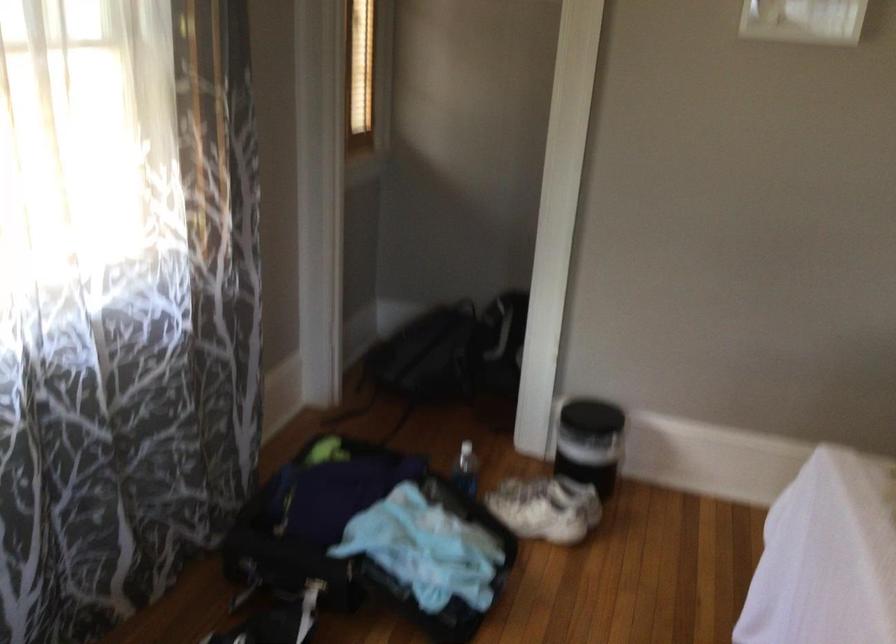
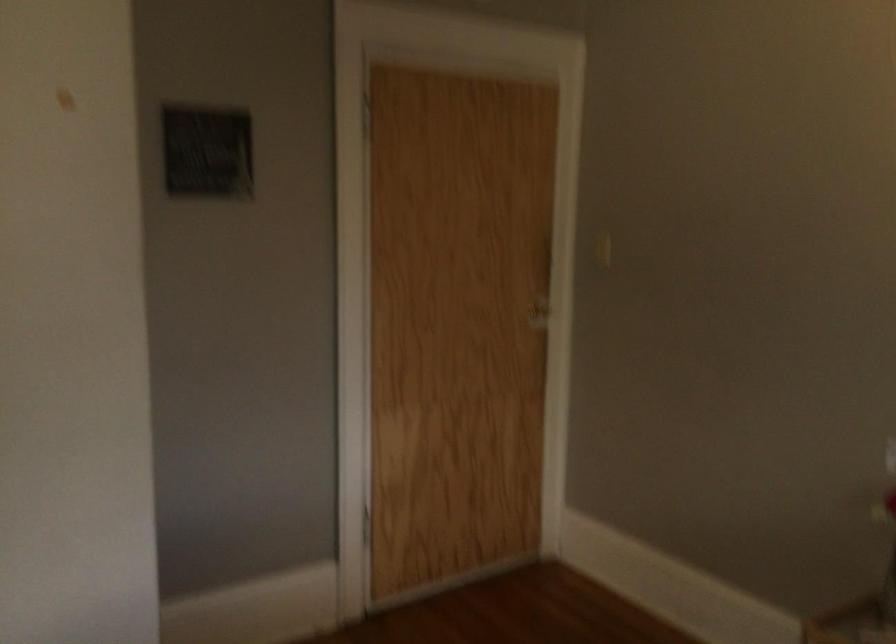
Question: How did the camera likely rotate?

Choices:
 (A) Left
 (B) Right
 (C) Up
 (D) Down

Answer: (B)